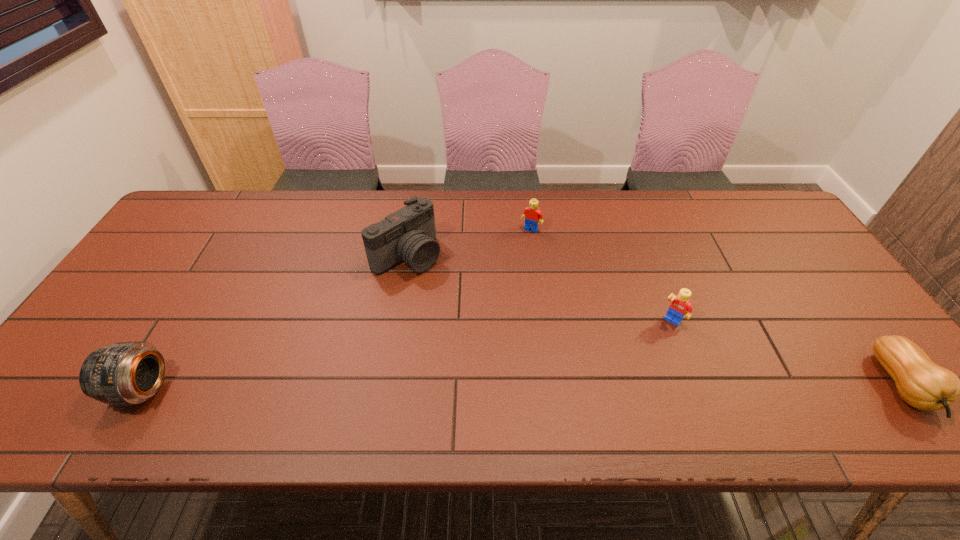
I want to click on empty location between the farthest object and the camera, so click(469, 242).

At what (x,y) coordinates should I click in order to perform the action: click on vacant space in between the left Lego and the second farthest object. Please return your answer as a coordinate pair (x, y). Looking at the image, I should click on (469, 242).

Locate an element on the screen. The image size is (960, 540). vacant space that's between the rightmost object and the fourth object from right to left is located at coordinates (x=655, y=321).

Locate an element on the screen. object that stands as the fourth closest to the left Lego is located at coordinates (125, 373).

Select which object appears as the third closest to the gourd. Please provide its 2D coordinates. Your answer should be formatted as a tuple, i.e. [(x, y)], where the tuple contains the x and y coordinates of a point satisfying the conditions above.

[(408, 235)]